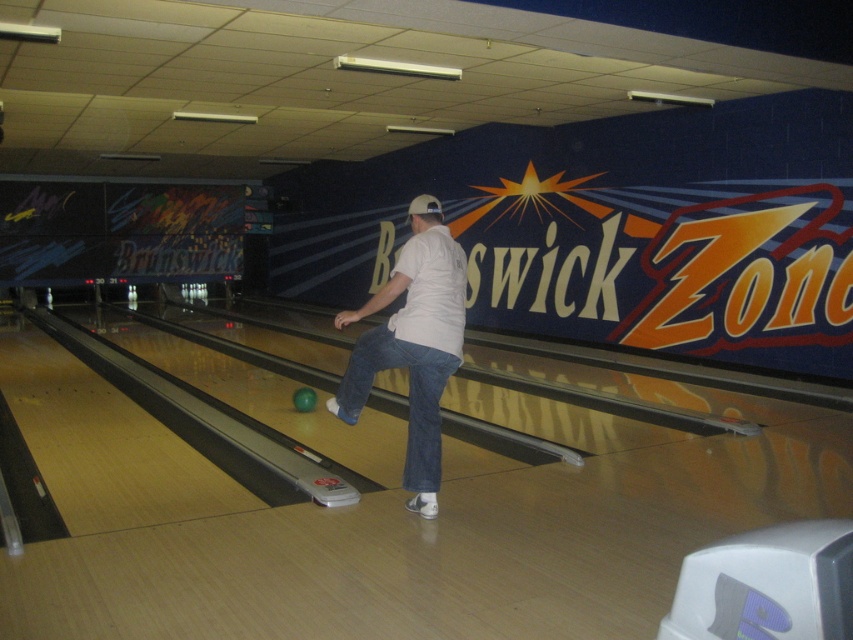
You are standing at the bowling alley and see the jeans at center and the green matte bowling ball at center. Which object is positioned to the right of the other?

The jeans at center is positioned to the right of the green matte bowling ball at center.

You are a bowler standing at the approach area of the lane. You see the white cotton shirt at center and the green matte bowling ball at center. Which object is positioned to the right side of the lane?

The white cotton shirt at center is positioned to the right of the green matte bowling ball at center, so the white cotton shirt at center is on the right side of the lane.

You are standing at the back of the bowling alley and want to know which of the two points, point (x=345, y=369) or point (x=372, y=355), is closer to you. Based on the scene, which point is nearer?

Point (x=345, y=369) is further to the viewer than point (x=372, y=355), so the point closer to you is point (x=372, y=355).